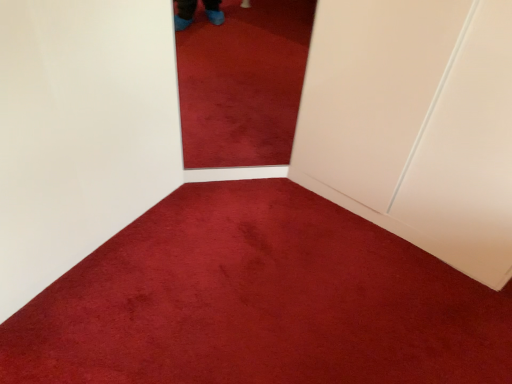
Question: Is white matte door at right wider or thinner than velvety red carpet at center?

Choices:
 (A) wide
 (B) thin

Answer: (B)

Question: From a real-world perspective, is white matte door at right positioned above or below velvety red carpet at center?

Choices:
 (A) below
 (B) above

Answer: (B)

Question: Is white matte door at right spatially inside velvety red carpet at center, or outside of it?

Choices:
 (A) inside
 (B) outside

Answer: (B)

Question: In the image, is velvety red carpet at center positioned in front of or behind white matte door at right?

Choices:
 (A) behind
 (B) front

Answer: (B)

Question: From a real-world perspective, is velvety red carpet at center physically located above or below white matte door at right?

Choices:
 (A) below
 (B) above

Answer: (A)

Question: Looking at the image, does velvety red carpet at center seem bigger or smaller compared to white matte door at right?

Choices:
 (A) big
 (B) small

Answer: (B)

Question: Is velvety red carpet at center inside or outside of white matte door at right?

Choices:
 (A) outside
 (B) inside

Answer: (A)